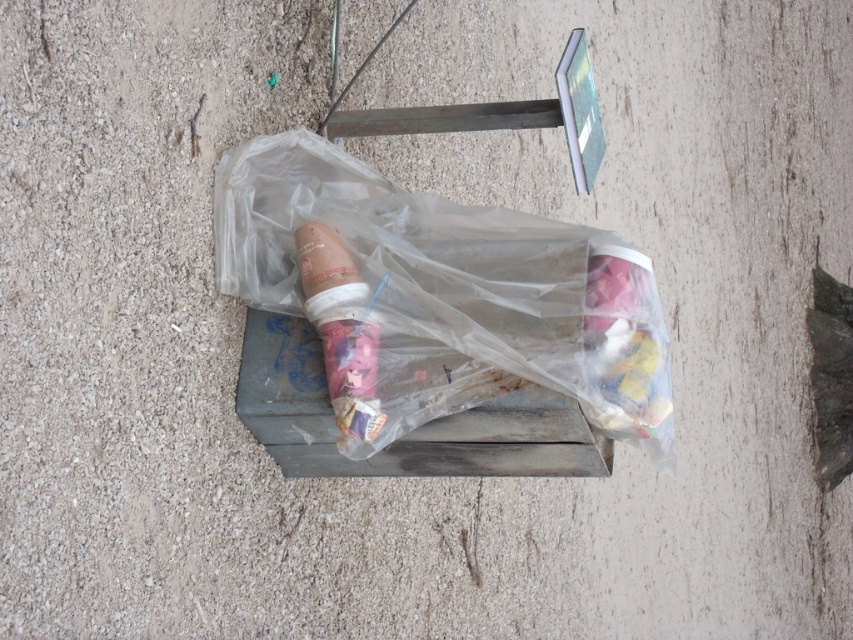
Question: Is transparent plastic bag at center below matte plastic ice cream cone at center?

Choices:
 (A) yes
 (B) no

Answer: (B)

Question: Which point is farther to the camera?

Choices:
 (A) matte plastic ice cream cone at center
 (B) transparent plastic bag at center

Answer: (A)

Question: Observing the image, what is the correct spatial positioning of transparent plastic bag at center in reference to matte plastic ice cream cone at center?

Choices:
 (A) below
 (B) above

Answer: (B)

Question: Which of the following is the closest to the observer?

Choices:
 (A) transparent plastic bag at center
 (B) matte plastic ice cream cone at center

Answer: (A)

Question: Considering the relative positions of transparent plastic bag at center and matte plastic ice cream cone at center in the image provided, where is transparent plastic bag at center located with respect to matte plastic ice cream cone at center?

Choices:
 (A) right
 (B) left

Answer: (A)